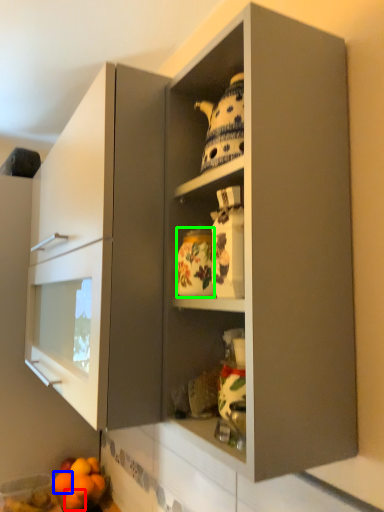
Question: Estimate the real-world distances between objects in this image. Which object is closer to orange (highlighted by a red box), orange (highlighted by a blue box) or pottery (highlighted by a green box)?

Choices:
 (A) orange
 (B) pottery

Answer: (A)